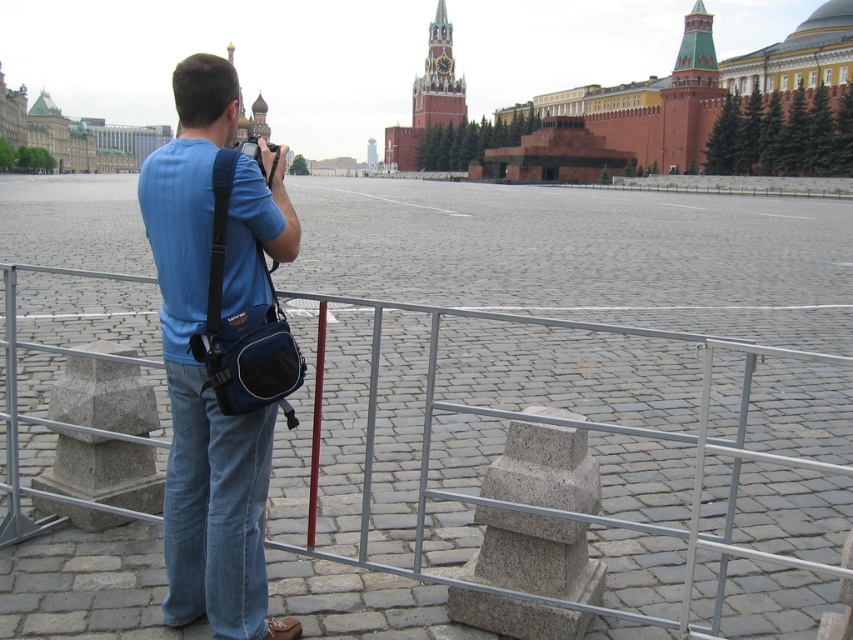
Does blue fabric bag at center have a lesser width compared to metallic silver fence at center?

Yes, blue fabric bag at center is thinner than metallic silver fence at center.

Is point (241, 282) positioned before point (689, 512)?

Yes, it is.

Locate an element on the screen. blue fabric bag at center is located at coordinates (219, 349).